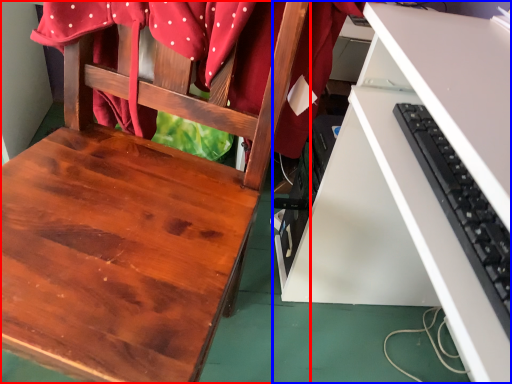
Question: Which object appears closest to the camera in this image, chair (highlighted by a red box) or desk (highlighted by a blue box)?

Choices:
 (A) chair
 (B) desk

Answer: (A)